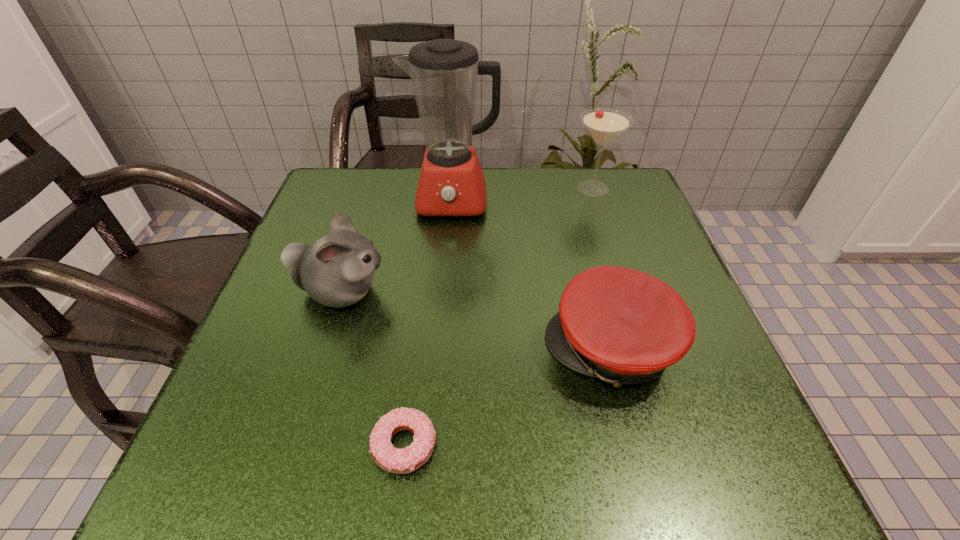
Identify the location of blender. (444, 73).

Find the location of a particular element. Image resolution: width=960 pixels, height=540 pixels. martini is located at coordinates (604, 125).

At what (x,y) coordinates should I click in order to perform the action: click on the third tallest object. Please return your answer as a coordinate pair (x, y). The image size is (960, 540). Looking at the image, I should click on (337, 270).

Where is `hamster`? This screenshot has height=540, width=960. hamster is located at coordinates (337, 270).

Find the location of a particular element. This screenshot has width=960, height=540. cap is located at coordinates (623, 326).

At what (x,y) coordinates should I click in order to perform the action: click on the shortest object. Please return your answer as a coordinate pair (x, y). The image size is (960, 540). Looking at the image, I should click on (394, 460).

Locate an element on the screen. The height and width of the screenshot is (540, 960). the nearest object is located at coordinates (394, 460).

Locate an element on the screen. The height and width of the screenshot is (540, 960). vacant space located 0.210m on the front of the tallest object near the controls is located at coordinates (446, 287).

Where is `vacant area situated on the front of the second tallest object`? The height and width of the screenshot is (540, 960). vacant area situated on the front of the second tallest object is located at coordinates (604, 222).

The height and width of the screenshot is (540, 960). What are the coordinates of `vacant point located on the face of the leftmost object` in the screenshot? It's located at (527, 293).